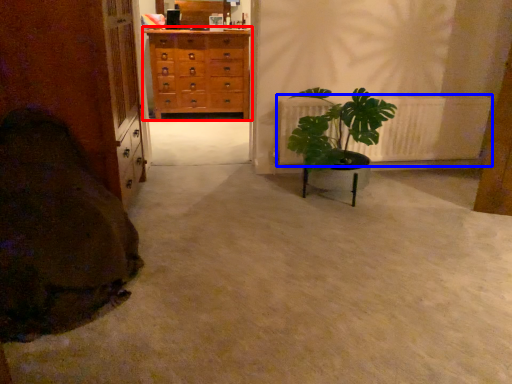
Question: Which object appears farthest to the camera in this image, chest of drawers (highlighted by a red box) or radiator (highlighted by a blue box)?

Choices:
 (A) chest of drawers
 (B) radiator

Answer: (A)